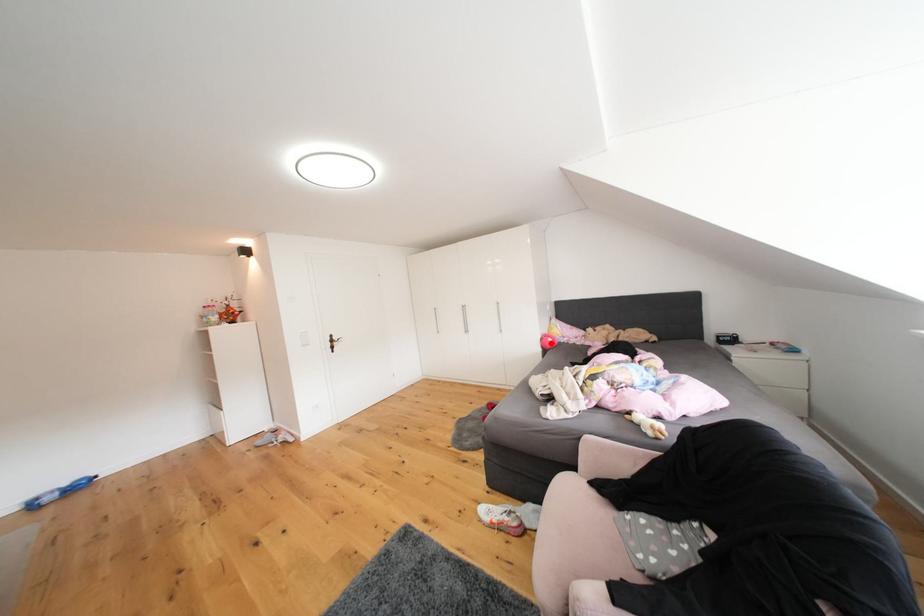
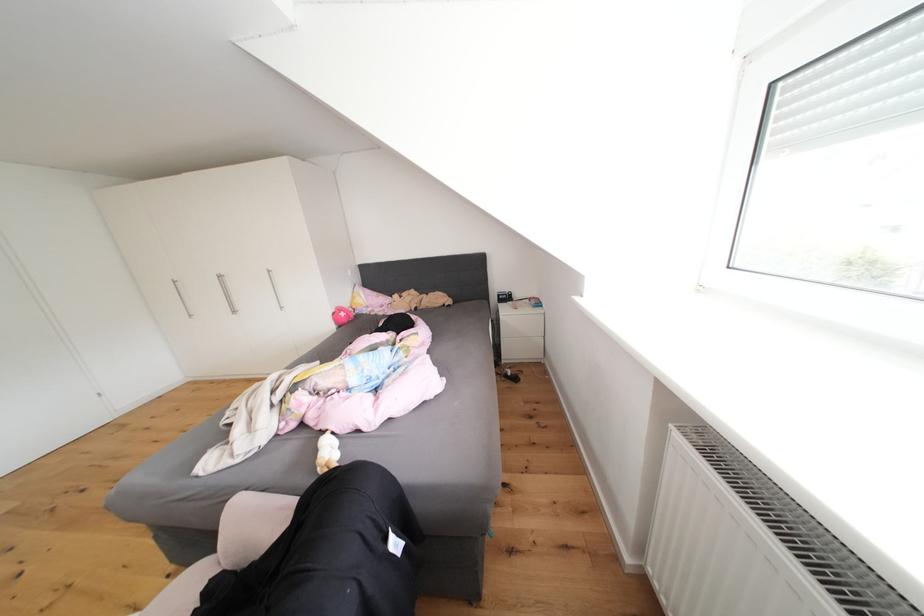
In the second image, find the point that corresponds to the highlighted location in the first image.

(343, 318)